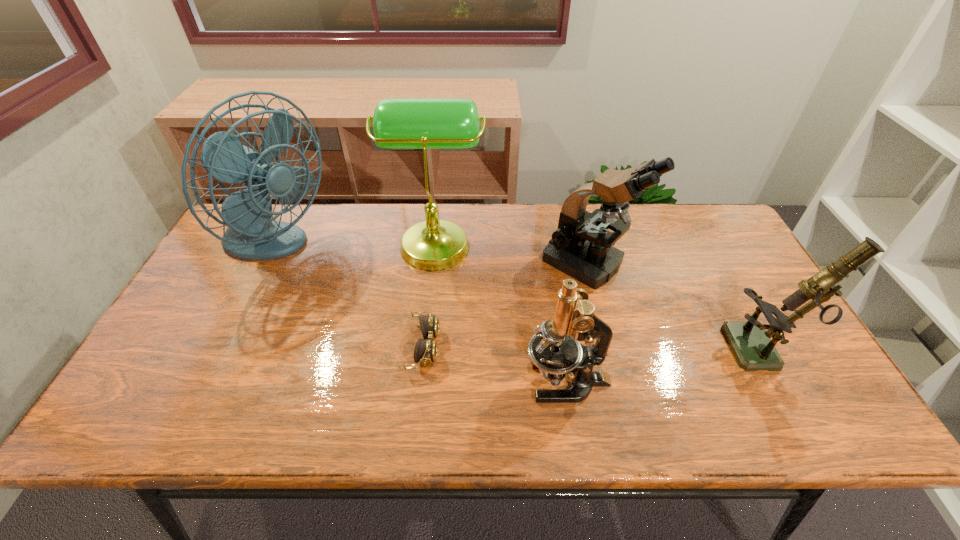
In the image, there is a desktop. Where is `vacant space at the left edge`? This screenshot has height=540, width=960. vacant space at the left edge is located at coordinates (198, 287).

Where is `vacant position at the far right corner of the desktop`? The width and height of the screenshot is (960, 540). vacant position at the far right corner of the desktop is located at coordinates (708, 206).

You are a GUI agent. You are given a task and a screenshot of the screen. Output one action in this format:
    pyautogui.click(x=<x>, y=<y>)
    Task: Click on the unoccupied area between the goggles and the leftmost object
    
    Given the screenshot: What is the action you would take?
    pyautogui.click(x=349, y=298)

This screenshot has height=540, width=960. I want to click on unoccupied position between the lamp and the farthest microscope, so pyautogui.click(x=512, y=252).

I want to click on vacant area between the goggles and the leftmost object, so click(349, 298).

The width and height of the screenshot is (960, 540). Find the location of `vacant point located between the rightmost microscope and the farthest microscope`. vacant point located between the rightmost microscope and the farthest microscope is located at coordinates (678, 308).

Find the location of `vacant space that is in between the shortest object and the farthest microscope`. vacant space that is in between the shortest object and the farthest microscope is located at coordinates pos(506,305).

This screenshot has height=540, width=960. I want to click on vacant area that lies between the leftmost object and the shortest object, so click(x=349, y=298).

Locate which object ranks fourth in proximity to the goggles. Please provide its 2D coordinates. Your answer should be formatted as a tuple, i.e. [(x, y)], where the tuple contains the x and y coordinates of a point satisfying the conditions above.

[(581, 247)]

Select which object is the fourth closest to the fan. Please provide its 2D coordinates. Your answer should be formatted as a tuple, i.e. [(x, y)], where the tuple contains the x and y coordinates of a point satisfying the conditions above.

[(581, 247)]